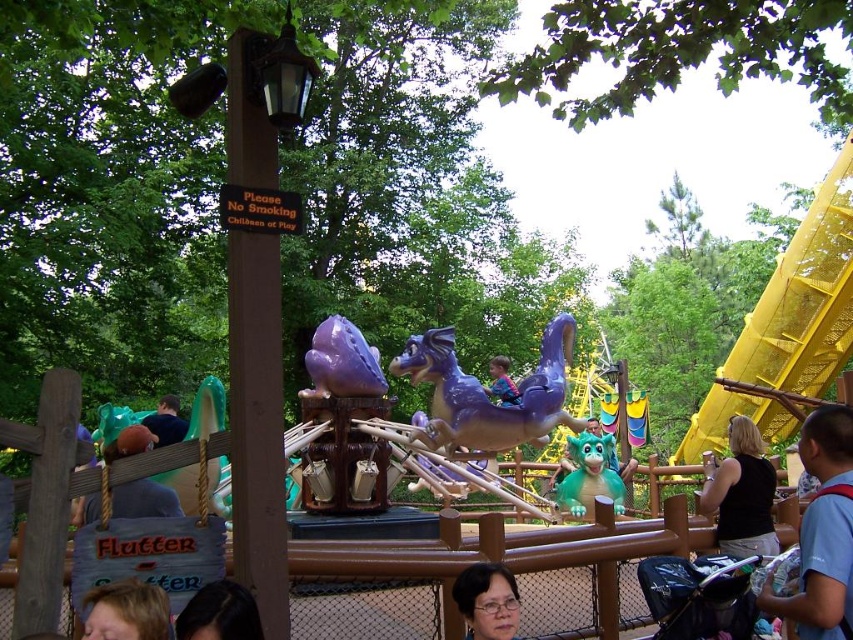
Can you confirm if brown plush toy at left is positioned above purple plastic dragon at center?

Incorrect, brown plush toy at left is not positioned above purple plastic dragon at center.

Does point (143, 515) come behind point (508, 387)?

No, it is in front of (508, 387).

The image size is (853, 640). Identify the location of brown plush toy at left. (144, 499).

Is yellow metallic slide at right thinner than blue shirt at lower right?

In fact, yellow metallic slide at right might be wider than blue shirt at lower right.

In the scene shown: Who is shorter, yellow metallic slide at right or blue shirt at lower right?

Standing shorter between the two is blue shirt at lower right.

Who is more distant from viewer, (840,236) or (846,488)?

The point (840,236) is more distant.

Locate an element on the screen. yellow metallic slide at right is located at coordinates (804, 298).

In the scene shown: Can you confirm if blue shirt at lower right is smaller than purple plastic dragon at center?

Yes, blue shirt at lower right is smaller than purple plastic dragon at center.

Who is positioned more to the right, blue shirt at lower right or purple plastic dragon at center?

blue shirt at lower right

Describe the element at coordinates (822, 532) in the screenshot. Image resolution: width=853 pixels, height=640 pixels. I see `blue shirt at lower right` at that location.

Locate an element on the screen. The image size is (853, 640). blue shirt at lower right is located at coordinates (822, 532).